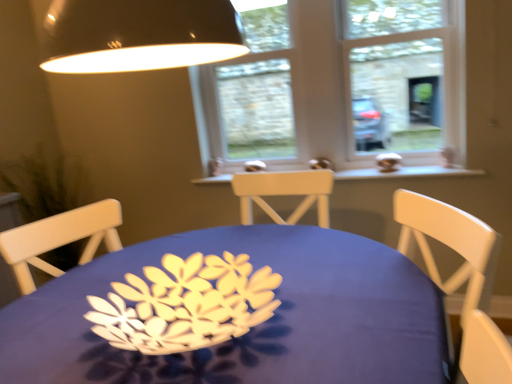
Question: From the image's perspective, is green matte plant at left beneath blue fabric table at center?

Choices:
 (A) no
 (B) yes

Answer: (A)

Question: Can you confirm if green matte plant at left is wider than blue fabric table at center?

Choices:
 (A) no
 (B) yes

Answer: (A)

Question: Is green matte plant at left taller than blue fabric table at center?

Choices:
 (A) yes
 (B) no

Answer: (A)

Question: Can you confirm if green matte plant at left is shorter than blue fabric table at center?

Choices:
 (A) no
 (B) yes

Answer: (A)

Question: Does green matte plant at left have a lesser width compared to blue fabric table at center?

Choices:
 (A) yes
 (B) no

Answer: (A)

Question: Is green matte plant at left not close to blue fabric table at center?

Choices:
 (A) yes
 (B) no

Answer: (A)

Question: Is green matte plant at left facing towards clear glass window at center?

Choices:
 (A) yes
 (B) no

Answer: (A)

Question: From a real-world perspective, is green matte plant at left under clear glass window at center?

Choices:
 (A) no
 (B) yes

Answer: (B)

Question: Considering the relative sizes of green matte plant at left and clear glass window at center in the image provided, is green matte plant at left taller than clear glass window at center?

Choices:
 (A) yes
 (B) no

Answer: (B)

Question: Is green matte plant at left closer to the viewer compared to clear glass window at center?

Choices:
 (A) no
 (B) yes

Answer: (B)

Question: Is green matte plant at left positioned beyond the bounds of clear glass window at center?

Choices:
 (A) no
 (B) yes

Answer: (B)

Question: Does green matte plant at left have a smaller size compared to clear glass window at center?

Choices:
 (A) yes
 (B) no

Answer: (B)

Question: Does clear glass window at center have a lesser height compared to white wood window sill at center?

Choices:
 (A) no
 (B) yes

Answer: (A)